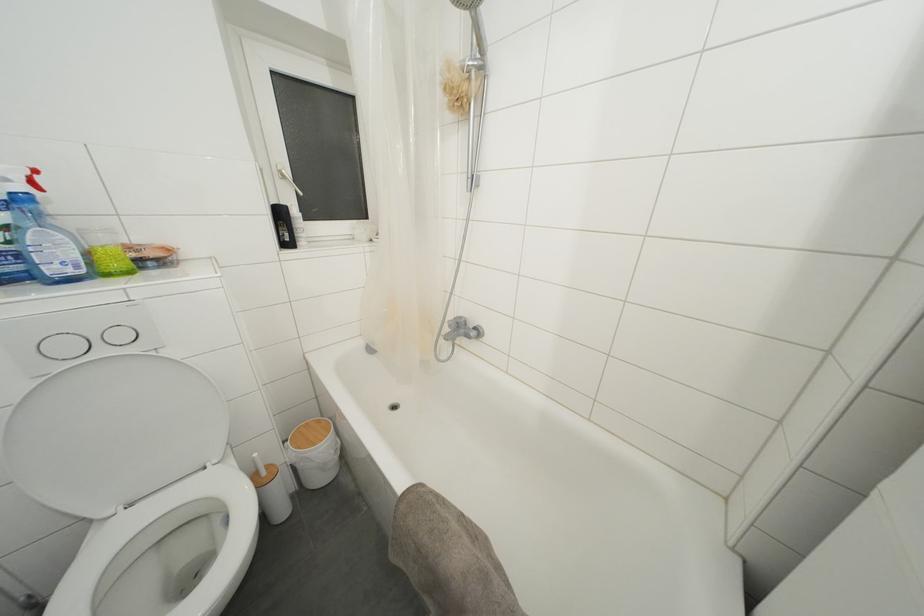
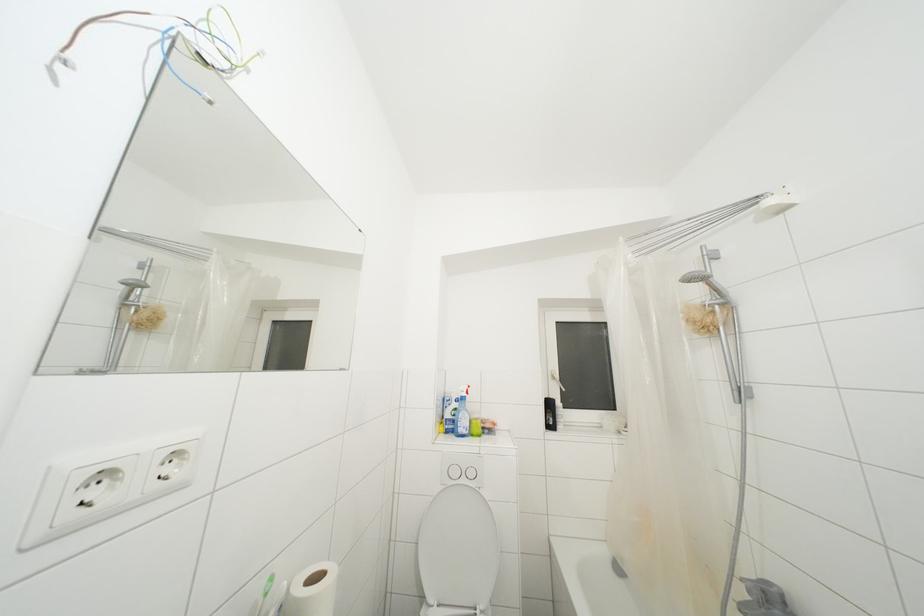
Based on the continuous images, in which direction is the camera rotating?

The camera rotated toward left-up.